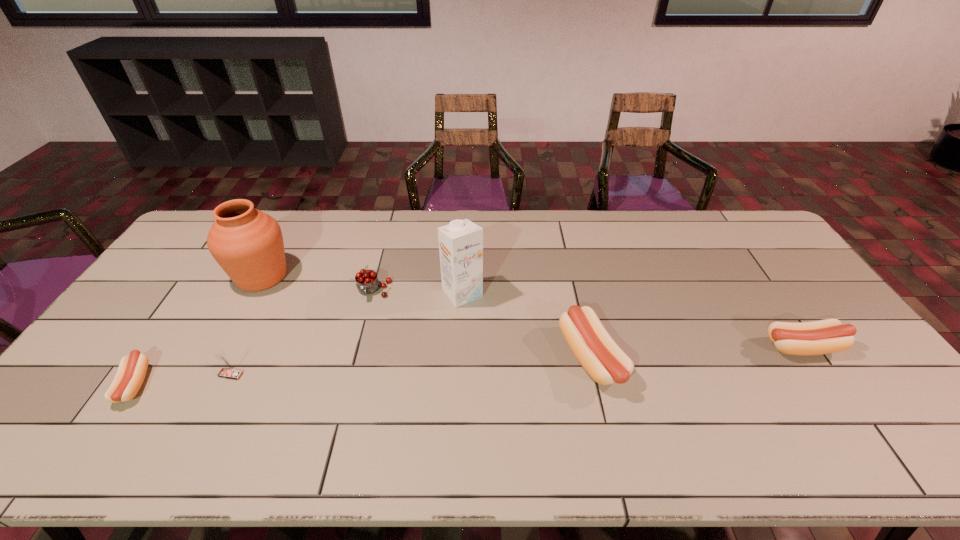
Identify the location of the leftmost object. (132, 369).

The width and height of the screenshot is (960, 540). What are the coordinates of `the shortest sausage` in the screenshot? It's located at (132, 369).

You are a GUI agent. You are given a task and a screenshot of the screen. Output one action in this format:
    pyautogui.click(x=<x>, y=<y>)
    Task: Click on the second sausage from right to left
    
    Given the screenshot: What is the action you would take?
    pyautogui.click(x=606, y=363)

The height and width of the screenshot is (540, 960). In order to click on the rightmost object in this screenshot , I will do (826, 336).

Identify the location of the second shortest sausage. This screenshot has width=960, height=540. (826, 336).

This screenshot has height=540, width=960. I want to click on cherry, so click(x=367, y=282).

Locate an element on the screen. The width and height of the screenshot is (960, 540). urn is located at coordinates (x=247, y=243).

The image size is (960, 540). I want to click on the fifth object from left to right, so click(x=461, y=242).

The height and width of the screenshot is (540, 960). I want to click on matchbox, so click(228, 371).

Locate an element on the screen. The width and height of the screenshot is (960, 540). vacant space located on the right of the leftmost object is located at coordinates (297, 384).